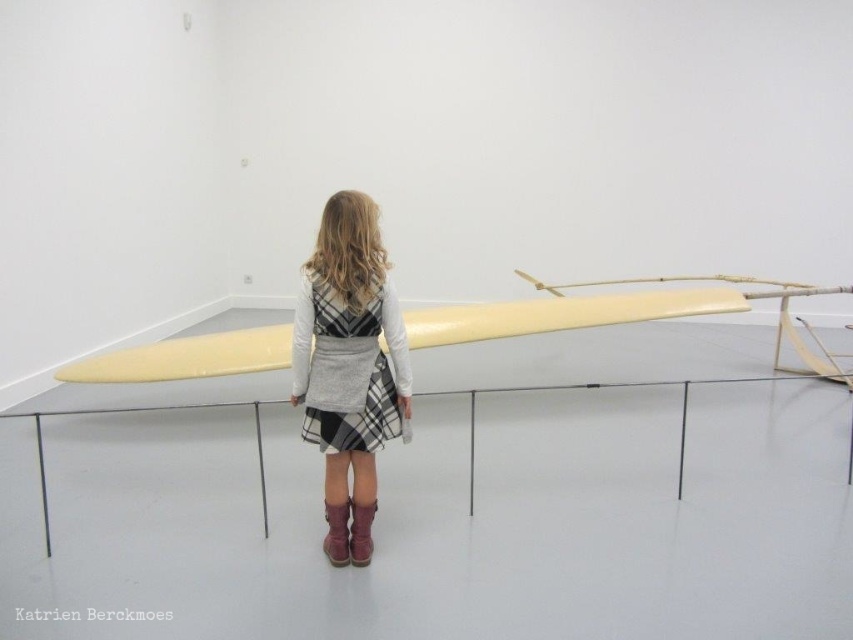
Question: Among these objects, which one is farthest from the camera?

Choices:
 (A) matte yellow surfboard at center
 (B) brown suede boot at center
 (C) brown suede boot at lower center

Answer: (A)

Question: Does matte yellow surfboard at center have a greater width compared to brown suede boot at center?

Choices:
 (A) yes
 (B) no

Answer: (A)

Question: Does plaid fabric dress at center appear on the right side of brown suede boot at center?

Choices:
 (A) yes
 (B) no

Answer: (A)

Question: Which point is farther from the camera taking this photo?

Choices:
 (A) (193, 346)
 (B) (368, 561)

Answer: (A)

Question: Can you confirm if plaid fabric dress at center is positioned to the left of matte yellow surfboard at center?

Choices:
 (A) yes
 (B) no

Answer: (A)

Question: Which object is positioned closest to the plaid fabric dress at center?

Choices:
 (A) matte yellow surfboard at center
 (B) brown suede boot at center

Answer: (B)